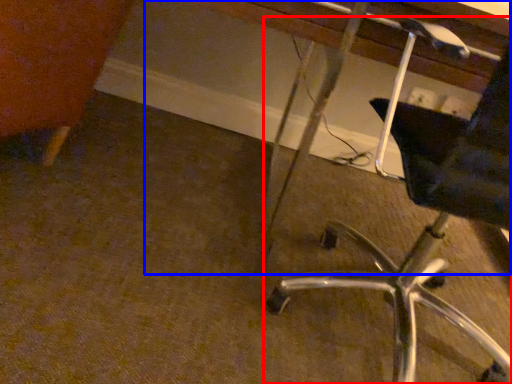
Question: Among these objects, which one is nearest to the camera, chair (highlighted by a red box) or vanity (highlighted by a blue box)?

Choices:
 (A) chair
 (B) vanity

Answer: (A)